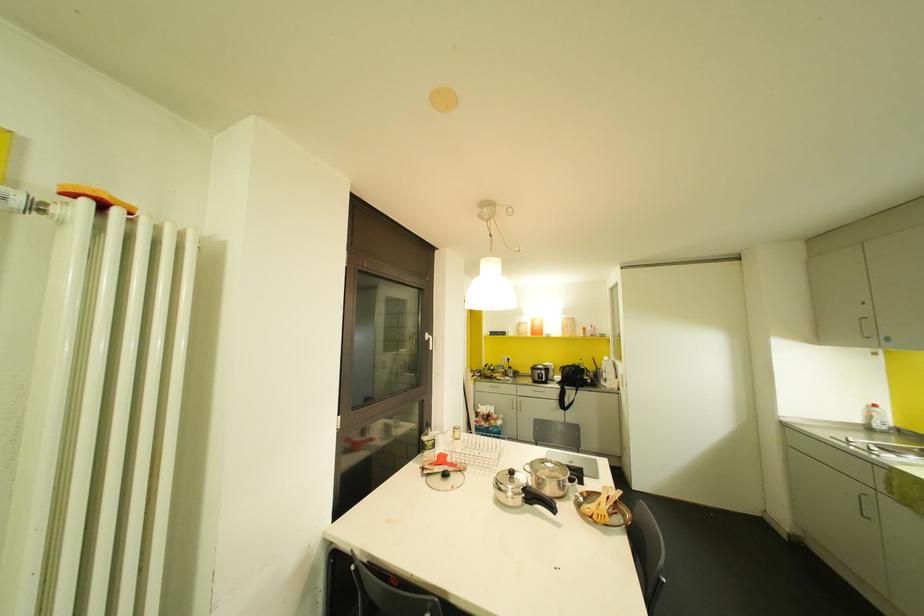
You are a GUI agent. You are given a task and a screenshot of the screen. Output one action in this format:
    pyautogui.click(x=<x>, y=<y>)
    Task: Click on the silver pot handle
    Image resolution: width=924 pixels, height=616 pixels.
    Given the screenshot: What is the action you would take?
    pyautogui.click(x=516, y=474)